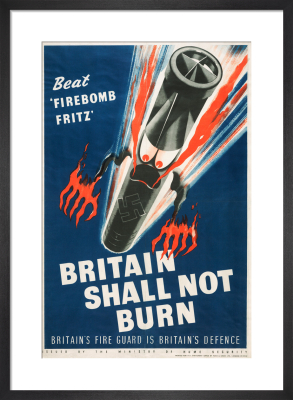
Where is `black frame around artwork`? Image resolution: width=293 pixels, height=400 pixels. black frame around artwork is located at coordinates (289, 273), (8, 271), (140, 397), (155, 6).